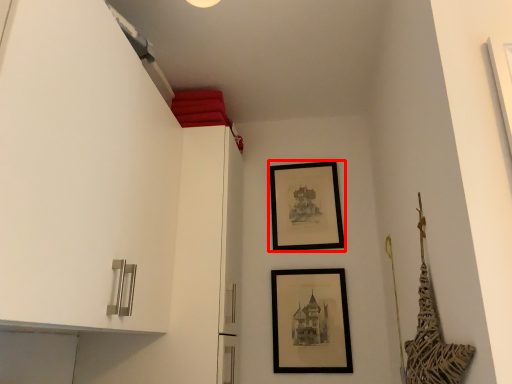
Question: From the image's perspective, what is the correct spatial positioning of picture frame (annotated by the red box) in reference to picture frame?

Choices:
 (A) above
 (B) below

Answer: (A)